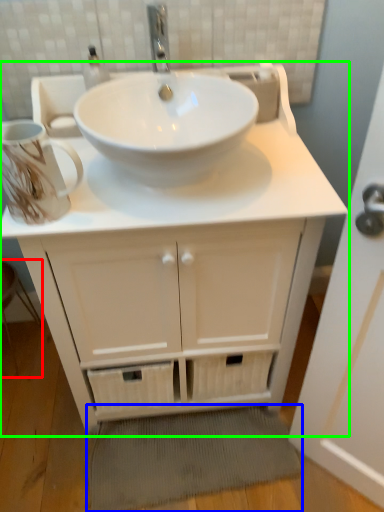
Question: Estimate the real-world distances between objects in this image. Which object is closer to step stool (highlighted by a red box), bath mat (highlighted by a blue box) or bathroom cabinet (highlighted by a green box)?

Choices:
 (A) bath mat
 (B) bathroom cabinet

Answer: (A)